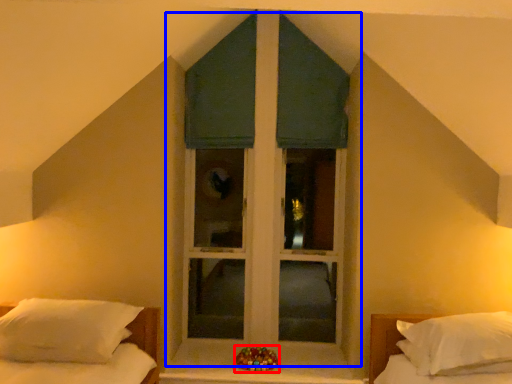
Question: Which point is further to the camera, miniature (highlighted by a red box) or window (highlighted by a blue box)?

Choices:
 (A) miniature
 (B) window

Answer: (B)